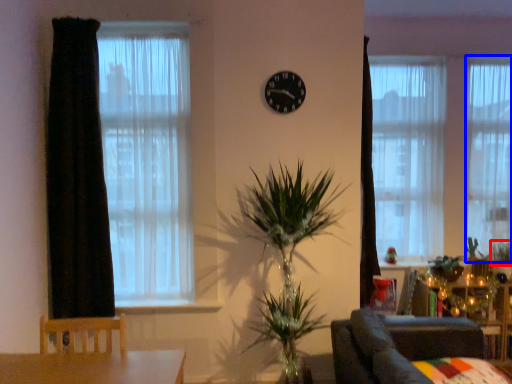
Question: Which of the following is the farthest to the observer, plant (highlighted by a red box) or curtain (highlighted by a blue box)?

Choices:
 (A) plant
 (B) curtain

Answer: (B)